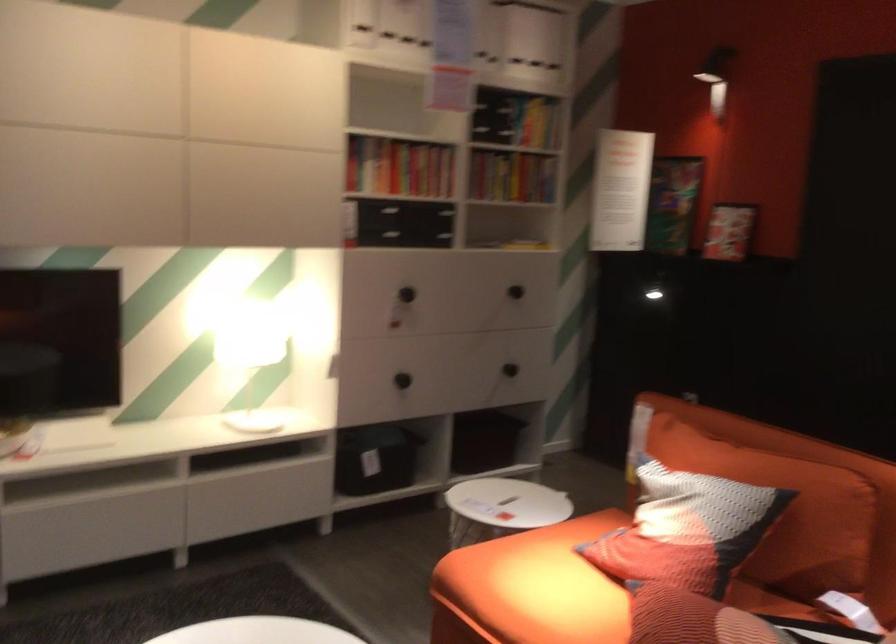
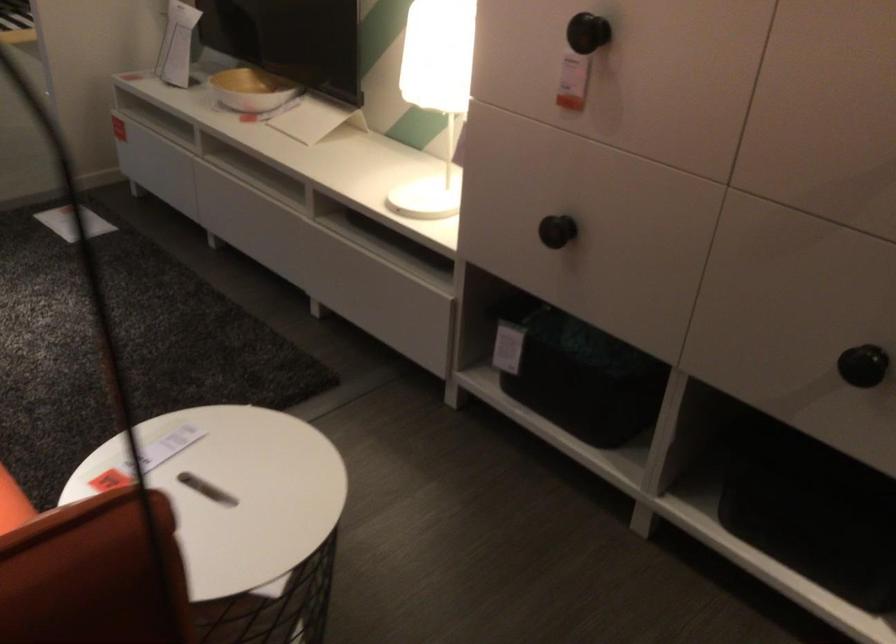
Find the pixel in the second image that matches pixel 250 354 in the first image.

(392, 76)